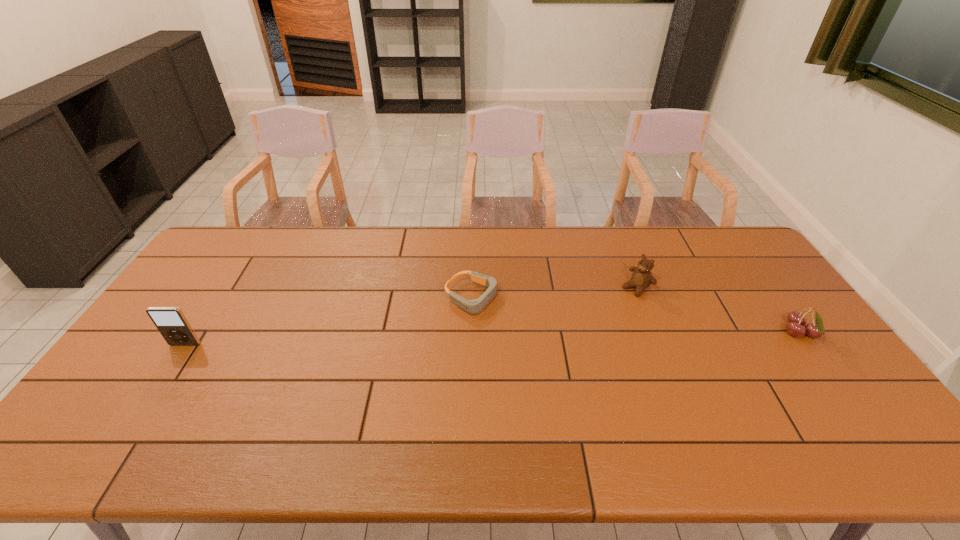
The height and width of the screenshot is (540, 960). I want to click on empty space between the third tallest object and the goggles, so click(636, 315).

This screenshot has height=540, width=960. In order to click on vacant area that lies between the leftmost object and the rightmost object in this screenshot , I will do `click(492, 339)`.

Identify the location of free point between the third shortest object and the second shortest object. (718, 310).

Choose which object is the nearest neighbor to the cherry. Please provide its 2D coordinates. Your answer should be formatted as a tuple, i.e. [(x, y)], where the tuple contains the x and y coordinates of a point satisfying the conditions above.

[(642, 278)]

Locate an element on the screen. Image resolution: width=960 pixels, height=540 pixels. the closest object to the second shortest object is located at coordinates (642, 278).

Where is `vacant region that satisfies the following two spatial constraints: 1. on the back side of the goggles; 2. on the right side of the teddy bear`? Image resolution: width=960 pixels, height=540 pixels. vacant region that satisfies the following two spatial constraints: 1. on the back side of the goggles; 2. on the right side of the teddy bear is located at coordinates (473, 288).

What are the coordinates of `free space that satisfies the following two spatial constraints: 1. on the front side of the third object from right to left; 2. on the leaves of the cherry` in the screenshot? It's located at click(472, 333).